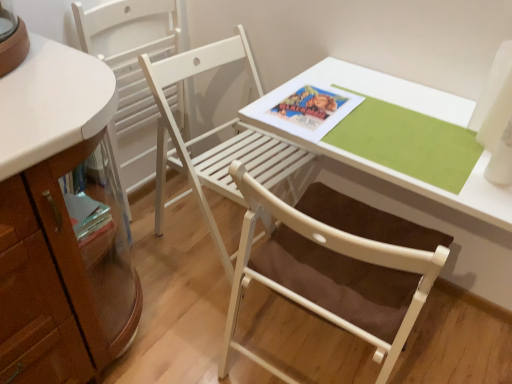
Locate an element on the screen. The height and width of the screenshot is (384, 512). free space in front of white wood chair at center, the second chair from the left is located at coordinates (187, 319).